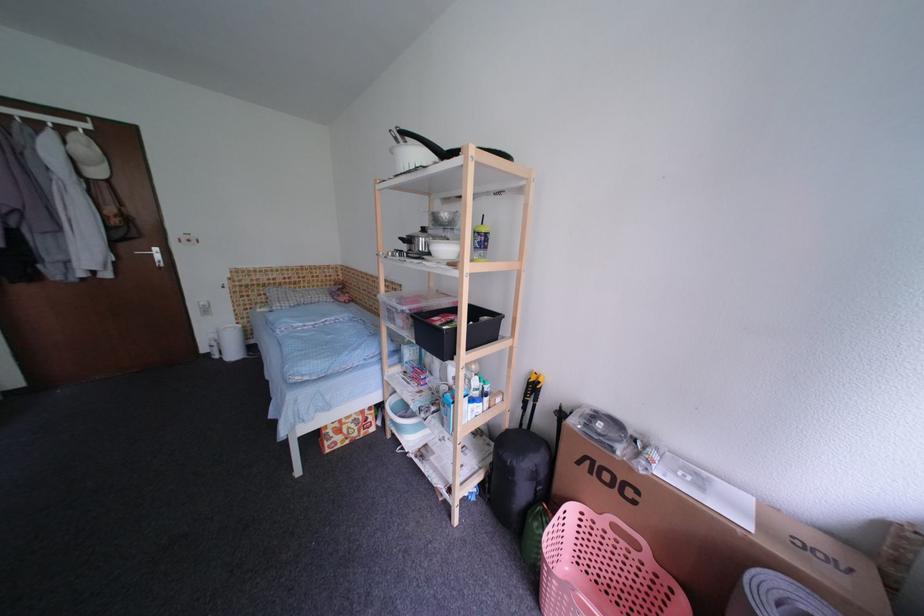
Describe the element at coordinates (444, 217) in the screenshot. I see `the metal bowl` at that location.